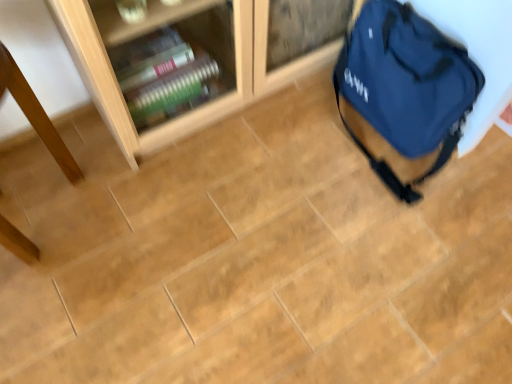
Question: Considering the relative positions of wooden table at left and blue fabric backpack at right in the image provided, is wooden table at left to the right of blue fabric backpack at right from the viewer's perspective?

Choices:
 (A) yes
 (B) no

Answer: (B)

Question: Considering the relative sizes of wooden table at left and blue fabric backpack at right in the image provided, is wooden table at left thinner than blue fabric backpack at right?

Choices:
 (A) yes
 (B) no

Answer: (B)

Question: From the image's perspective, is wooden table at left beneath blue fabric backpack at right?

Choices:
 (A) no
 (B) yes

Answer: (B)

Question: Can you confirm if wooden table at left is smaller than blue fabric backpack at right?

Choices:
 (A) yes
 (B) no

Answer: (B)

Question: Is wooden table at left positioned beyond the bounds of blue fabric backpack at right?

Choices:
 (A) no
 (B) yes

Answer: (B)

Question: Is there a large distance between wooden table at left and blue fabric backpack at right?

Choices:
 (A) yes
 (B) no

Answer: (B)

Question: Is blue fabric backpack at right not near wooden table at left?

Choices:
 (A) no
 (B) yes

Answer: (A)

Question: From the image's perspective, is blue fabric backpack at right on top of wooden table at left?

Choices:
 (A) no
 (B) yes

Answer: (B)

Question: Is blue fabric backpack at right facing away from wooden table at left?

Choices:
 (A) no
 (B) yes

Answer: (A)

Question: From a real-world perspective, does blue fabric backpack at right sit lower than wooden table at left?

Choices:
 (A) no
 (B) yes

Answer: (B)

Question: Is blue fabric backpack at right outside wooden table at left?

Choices:
 (A) yes
 (B) no

Answer: (A)

Question: Is the surface of blue fabric backpack at right in direct contact with wooden table at left?

Choices:
 (A) no
 (B) yes

Answer: (A)

Question: Would you say wooden table at left is to the left or to the right of blue fabric backpack at right in the picture?

Choices:
 (A) left
 (B) right

Answer: (A)